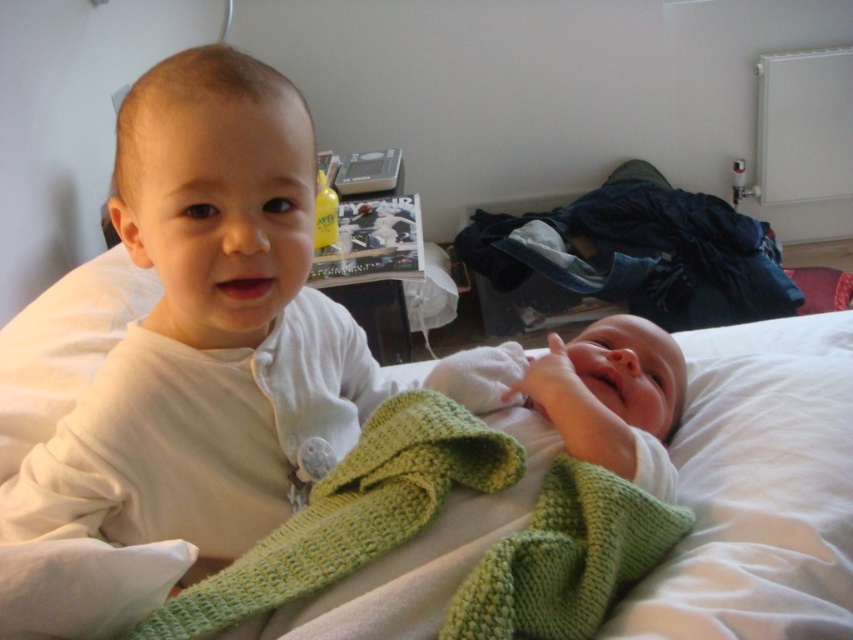
Question: Which point is closer to the camera taking this photo?

Choices:
 (A) (479, 440)
 (B) (793, 518)

Answer: (A)

Question: Which point is closer to the camera?

Choices:
 (A) (582, 332)
 (B) (206, 461)
 (C) (170, 612)

Answer: (C)

Question: Can you confirm if white matte baby at upper left is positioned below white soft bed at center?

Choices:
 (A) no
 (B) yes

Answer: (A)

Question: From the image, what is the correct spatial relationship of white matte baby at upper left in relation to white soft bed at center?

Choices:
 (A) left
 (B) right

Answer: (A)

Question: Which object is farther from the camera taking this photo?

Choices:
 (A) white soft bed at center
 (B) white matte baby at upper left

Answer: (A)

Question: From the image, what is the correct spatial relationship of white soft bed at center in relation to green knitted blanket at center?

Choices:
 (A) left
 (B) right

Answer: (B)